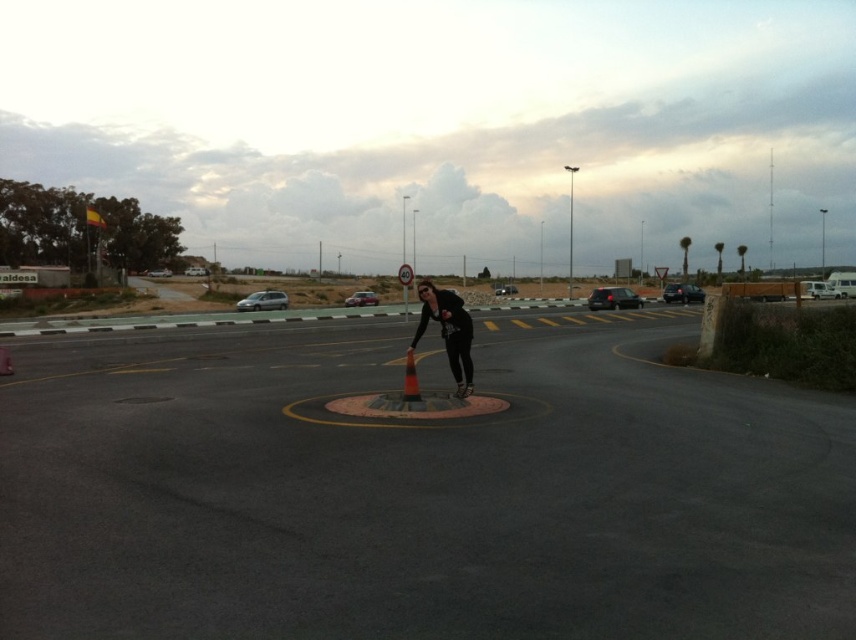
Question: Is orange matte traffic cone at center positioned in front of matte black car at center?

Choices:
 (A) yes
 (B) no

Answer: (A)

Question: Is satin silver minivan at left further to camera compared to matte black car at center?

Choices:
 (A) no
 (B) yes

Answer: (A)

Question: Which of these objects is positioned closest to the black glossy car at right?

Choices:
 (A) metallic silver car at center
 (B) orange matte traffic cone at center
 (C) shiny black sedan at right
 (D) satin silver minivan at left

Answer: (C)

Question: Considering the relative positions of satin silver minivan at left and matte black car at center in the image provided, where is satin silver minivan at left located with respect to matte black car at center?

Choices:
 (A) below
 (B) above

Answer: (A)

Question: Which point is farther to the camera?

Choices:
 (A) satin silver minivan at left
 (B) black glossy car at right
 (C) shiny black sedan at right
 (D) matte black car at center

Answer: (D)

Question: Among these objects, which one is nearest to the camera?

Choices:
 (A) black glossy car at right
 (B) metallic silver car at center

Answer: (A)